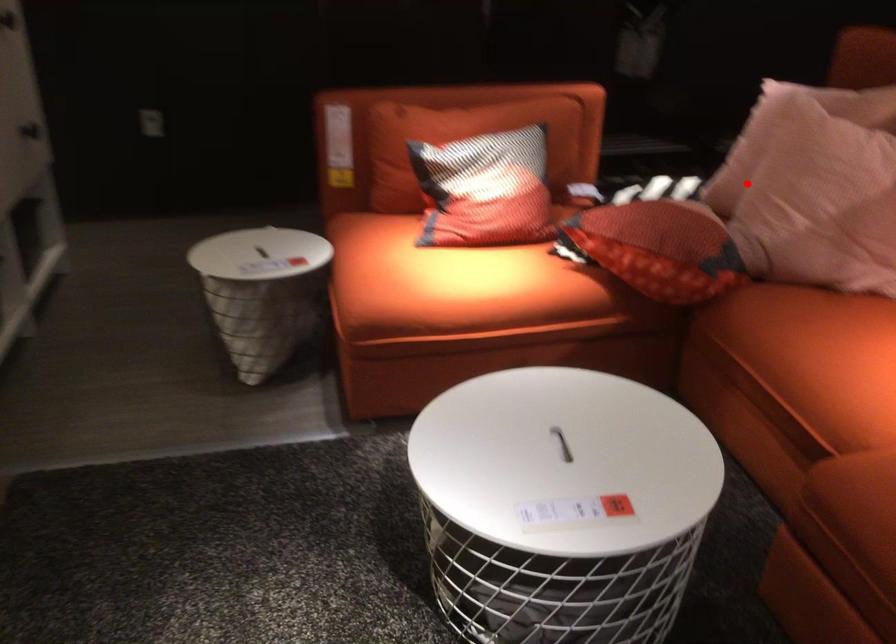
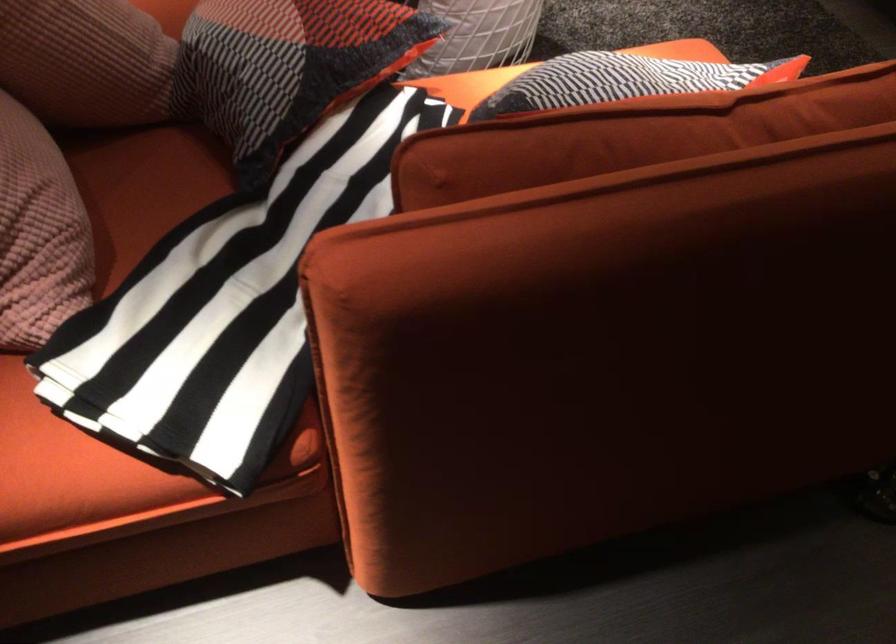
In the second image, find the point that corresponds to the highlighted location in the first image.

(85, 61)